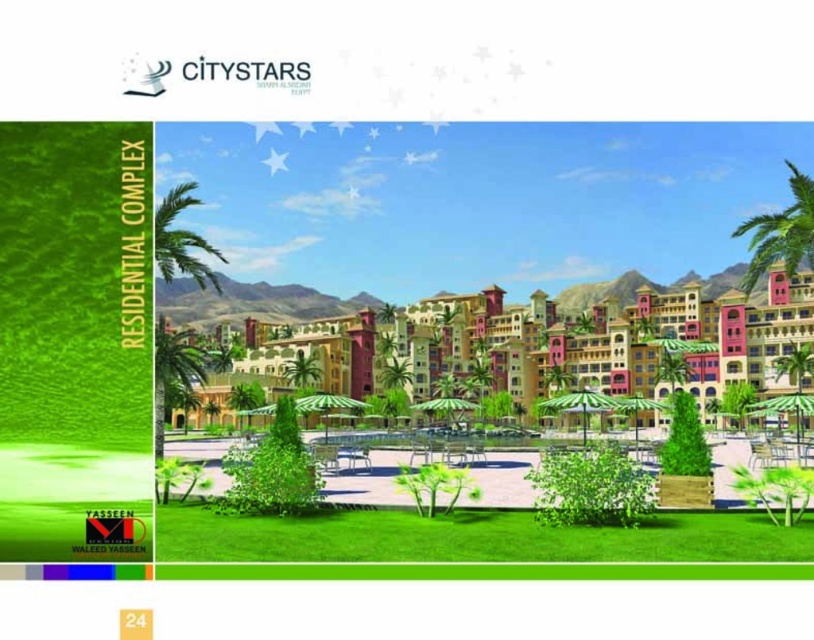
You are standing in the residential complex and want to take a photo that includes both the point at coordinates (797, 326) and the point at (791, 362). Since one is closer to you than the other, which point should you focus on to ensure both are in focus?

You should focus on the point at (797, 326) because it is closer to you than the other point at (791, 362). By focusing on the closer point, the depth of field may include the farther one as well, ensuring both are in focus.

Based on the scene description, what are the coordinates of the multicolored stucco buildings at center?

The multicolored stucco buildings at center are located at coordinates point (611, 340).